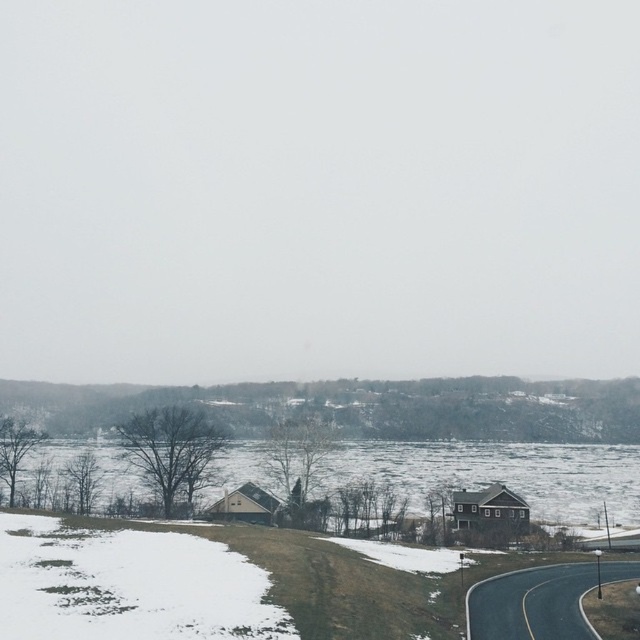
Question: Is brown wooden house at center to the left of white powdery snow at lower left from the viewer's perspective?

Choices:
 (A) yes
 (B) no

Answer: (B)

Question: Can you confirm if snowy grassy hill at center is positioned above white powdery snow at lower left?

Choices:
 (A) no
 (B) yes

Answer: (B)

Question: Which object appears closest to the camera in this image?

Choices:
 (A) snowy grassy hill at center
 (B) brown wooden house at center

Answer: (B)

Question: Which point is closer to the camera?

Choices:
 (A) (355, 387)
 (B) (10, 531)
 (C) (324, 468)

Answer: (B)

Question: Does brown wooden house at center come behind snowy grassy hill at center?

Choices:
 (A) no
 (B) yes

Answer: (A)

Question: Which object is positioned closest to the snowy grassy hill at center?

Choices:
 (A) white powdery snow at lower left
 (B) brown wooden house at center

Answer: (B)